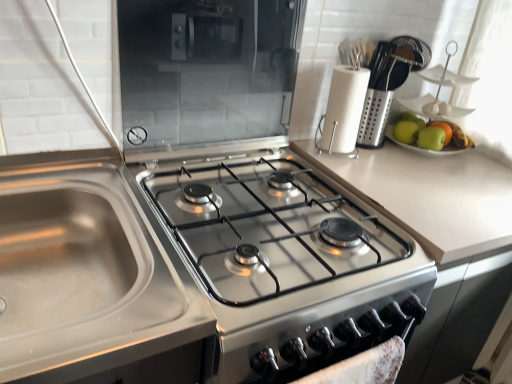
This screenshot has height=384, width=512. Identify the location of free location to the right of green matte apple at upper right, which ranks as the 1th apple in left-to-right order. (471, 162).